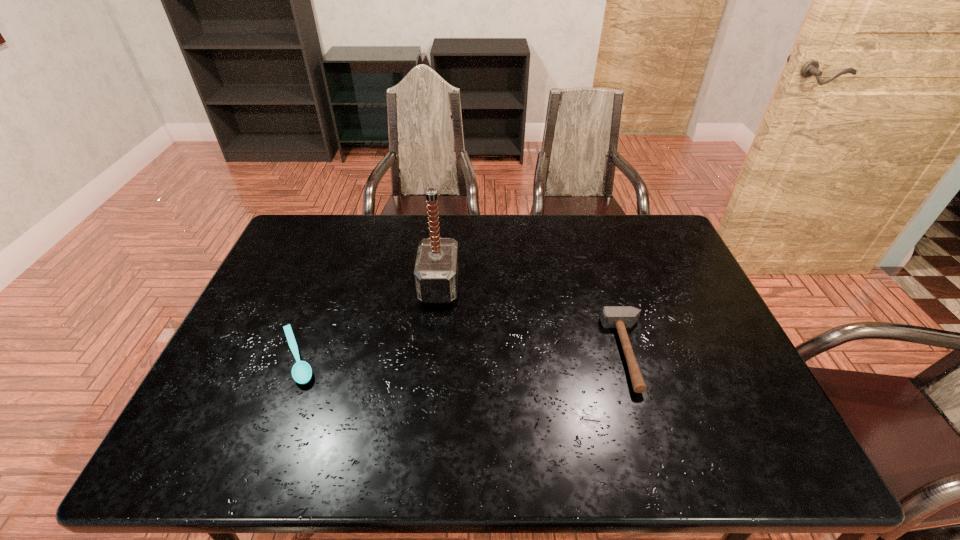
The width and height of the screenshot is (960, 540). Identify the location of the tallest object. (436, 269).

You are a GUI agent. You are given a task and a screenshot of the screen. Output one action in this format:
    pyautogui.click(x=<x>, y=<y>)
    Task: Click on the farthest object
    
    Given the screenshot: What is the action you would take?
    pyautogui.click(x=436, y=269)

This screenshot has height=540, width=960. Identify the location of the nearer hammer. (621, 317).

Identify the location of the rightmost object. This screenshot has width=960, height=540. (621, 317).

Where is `the leftmost object`? the leftmost object is located at coordinates click(x=301, y=371).

The image size is (960, 540). In order to click on the shortest object in this screenshot , I will do `click(301, 371)`.

The height and width of the screenshot is (540, 960). I want to click on vacant space located on the front of the left hammer, so click(x=433, y=346).

Find the location of a particular element. The width and height of the screenshot is (960, 540). free region located 0.350m on the striking surface of the nearer hammer is located at coordinates (474, 353).

This screenshot has width=960, height=540. I want to click on vacant space located on the striking surface of the nearer hammer, so click(532, 353).

Where is `vacant space located on the striking surface of the nearer hammer`? This screenshot has height=540, width=960. vacant space located on the striking surface of the nearer hammer is located at coordinates (493, 353).